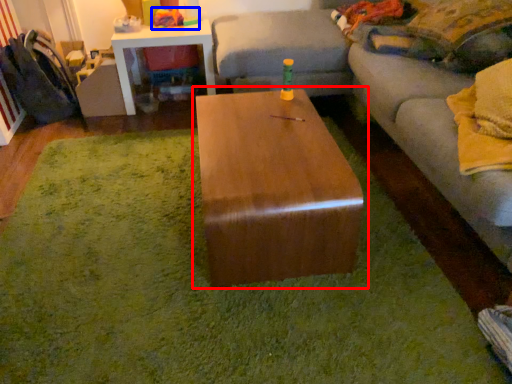
Question: Which of the following is the farthest to the observer, coffee table (highlighted by a red box) or toy (highlighted by a blue box)?

Choices:
 (A) coffee table
 (B) toy

Answer: (B)